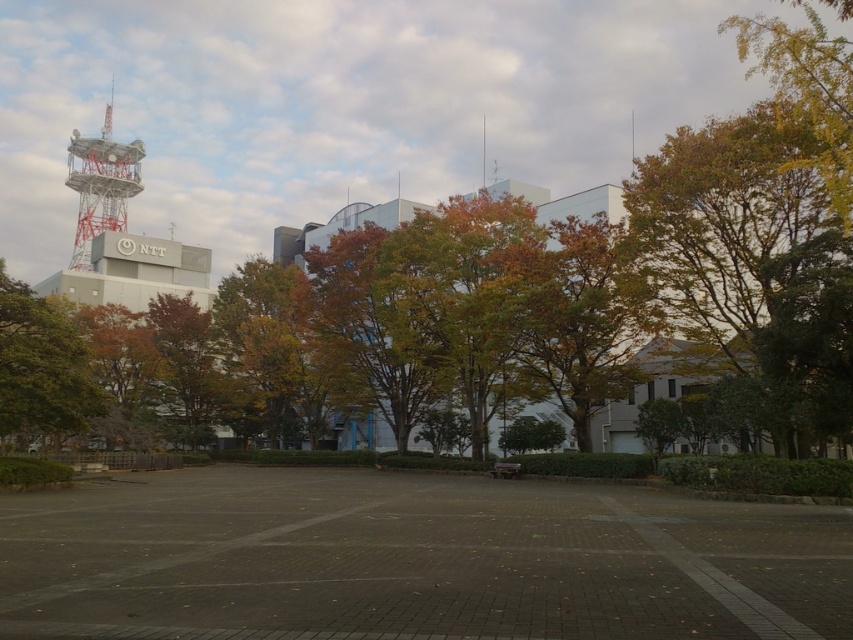
The height and width of the screenshot is (640, 853). What do you see at coordinates (807, 90) in the screenshot? I see `yellow-green leaves at upper right` at bounding box center [807, 90].

Does yellow-green leaves at upper right have a smaller size compared to metallic lattice tower at upper left?

No, yellow-green leaves at upper right is not smaller than metallic lattice tower at upper left.

What do you see at coordinates (807, 90) in the screenshot?
I see `yellow-green leaves at upper right` at bounding box center [807, 90].

Find the location of `yellow-green leaves at upper right`. yellow-green leaves at upper right is located at coordinates (807, 90).

Is gray concrete parking lot at center to the right of metallic lattice tower at upper left from the viewer's perspective?

Yes, gray concrete parking lot at center is to the right of metallic lattice tower at upper left.

Can you confirm if gray concrete parking lot at center is wider than metallic lattice tower at upper left?

In fact, gray concrete parking lot at center might be narrower than metallic lattice tower at upper left.

Does point (222, 476) lie in front of point (67, 150)?

Yes, it is in front of point (67, 150).

Where is `gray concrete parking lot at center`? Image resolution: width=853 pixels, height=640 pixels. gray concrete parking lot at center is located at coordinates (413, 561).

Which is in front, point (0, 397) or point (126, 166)?

Point (0, 397) is in front.

Does green leafy tree at left have a larger size compared to metallic lattice tower at upper left?

No, green leafy tree at left is not bigger than metallic lattice tower at upper left.

I want to click on green leafy tree at left, so click(42, 365).